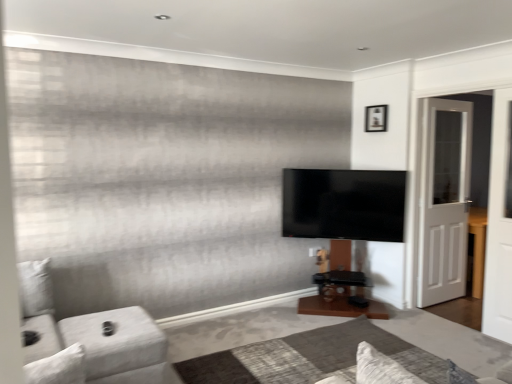
Question: Is white wooden door at right in front of or behind white wooden screen door at right in the image?

Choices:
 (A) front
 (B) behind

Answer: (B)

Question: From a real-world perspective, relative to white wooden screen door at right, is white wooden door at right vertically above or below?

Choices:
 (A) below
 (B) above

Answer: (A)

Question: Which object is positioned farthest from the white wooden screen door at right?

Choices:
 (A) matte black tv at center
 (B) wooden picture frame at upper right
 (C) white wooden door at right
 (D) white fabric couch at lower left

Answer: (D)

Question: Based on their relative distances, which object is nearer to the white fabric couch at lower left?

Choices:
 (A) white wooden screen door at right
 (B) matte black tv at center
 (C) wooden picture frame at upper right
 (D) white wooden door at right

Answer: (B)